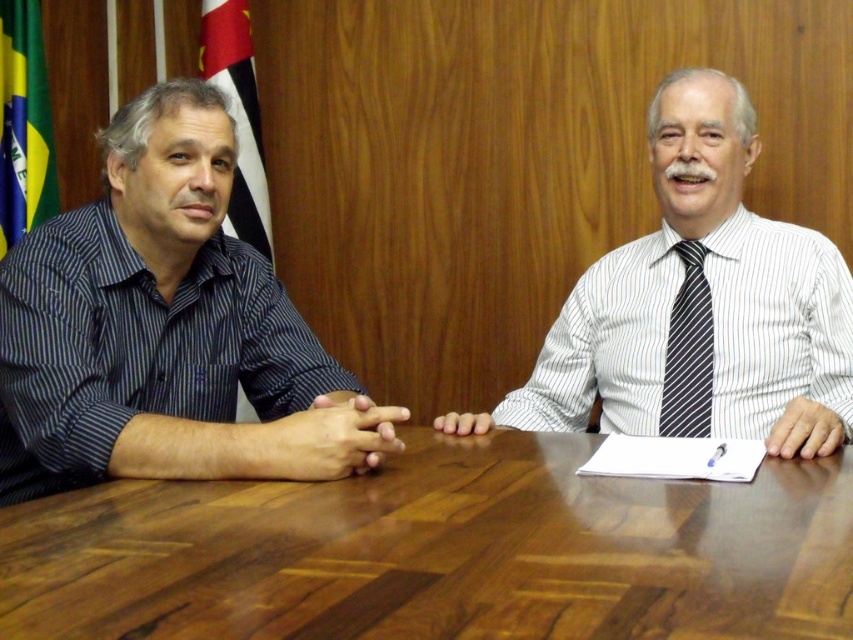
Which is above, brown wood table at center or striped fabric tie at center?

Positioned higher is striped fabric tie at center.

Who is more forward, (x=438, y=506) or (x=672, y=362)?

Point (x=438, y=506)

This screenshot has height=640, width=853. What are the coordinates of `brown wood table at center` in the screenshot? It's located at (439, 552).

Does point (219, 108) lie behind point (781, 225)?

That is False.

Who is more distant from viewer, (141,314) or (785,224)?

Positioned behind is point (785,224).

Does point (111, 228) come behind point (706, 300)?

No, (111, 228) is in front of (706, 300).

The width and height of the screenshot is (853, 640). I want to click on dark blue striped shirt at left, so click(165, 330).

Does red fabric flag at left have a greater height compared to striped fabric tie at center?

Yes, red fabric flag at left is taller than striped fabric tie at center.

Who is more distant from viewer, [230,70] or [666,376]?

Positioned behind is point [230,70].

What are the coordinates of `red fabric flag at left` in the screenshot? It's located at (238, 116).